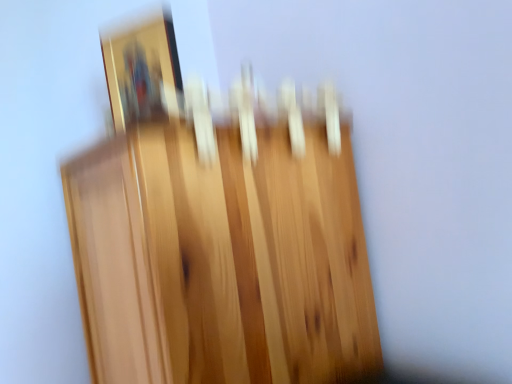
What do you see at coordinates (218, 232) in the screenshot?
I see `natural wood cutting board at center` at bounding box center [218, 232].

Where is `natural wood cutting board at center`? This screenshot has width=512, height=384. natural wood cutting board at center is located at coordinates (218, 232).

In order to face natural wood cutting board at center, should I rotate leftwards or rightwards?

Turn left approximately 4.473 degrees to face it.

The width and height of the screenshot is (512, 384). I want to click on natural wood cutting board at center, so click(x=218, y=232).